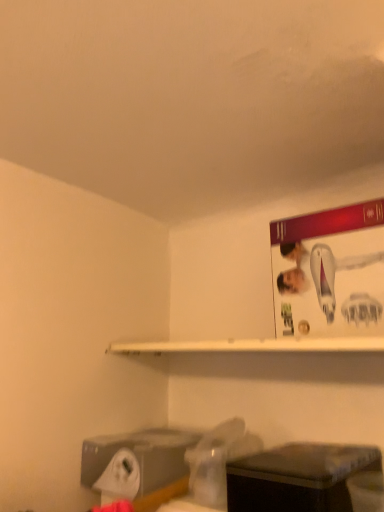
Question: Can you confirm if black plastic box at lower right is wider than white matte shelf at upper center?

Choices:
 (A) yes
 (B) no

Answer: (A)

Question: From a real-world perspective, is black plastic box at lower right below white matte shelf at upper center?

Choices:
 (A) yes
 (B) no

Answer: (A)

Question: Does black plastic box at lower right have a smaller size compared to white matte shelf at upper center?

Choices:
 (A) yes
 (B) no

Answer: (B)

Question: Is the position of black plastic box at lower right more distant than that of white matte shelf at upper center?

Choices:
 (A) no
 (B) yes

Answer: (A)

Question: Is black plastic box at lower right touching white matte shelf at upper center?

Choices:
 (A) yes
 (B) no

Answer: (B)

Question: Are black plastic box at lower right and white matte shelf at upper center located far from each other?

Choices:
 (A) yes
 (B) no

Answer: (B)

Question: Is white matte shelf at upper center further to the viewer compared to black plastic box at lower right?

Choices:
 (A) yes
 (B) no

Answer: (A)

Question: Considering the relative sizes of white matte shelf at upper center and black plastic box at lower right in the image provided, is white matte shelf at upper center thinner than black plastic box at lower right?

Choices:
 (A) no
 (B) yes

Answer: (B)

Question: Is white matte shelf at upper center taller than black plastic box at lower right?

Choices:
 (A) no
 (B) yes

Answer: (A)

Question: From a real-world perspective, is white matte shelf at upper center positioned under black plastic box at lower right based on gravity?

Choices:
 (A) no
 (B) yes

Answer: (A)

Question: Can you confirm if white matte shelf at upper center is shorter than black plastic box at lower right?

Choices:
 (A) no
 (B) yes

Answer: (B)

Question: Is black plastic box at lower right surrounded by white matte shelf at upper center?

Choices:
 (A) no
 (B) yes

Answer: (A)

Question: Based on their positions, is white matte shelf at upper center located to the left or right of black plastic box at lower right?

Choices:
 (A) left
 (B) right

Answer: (A)